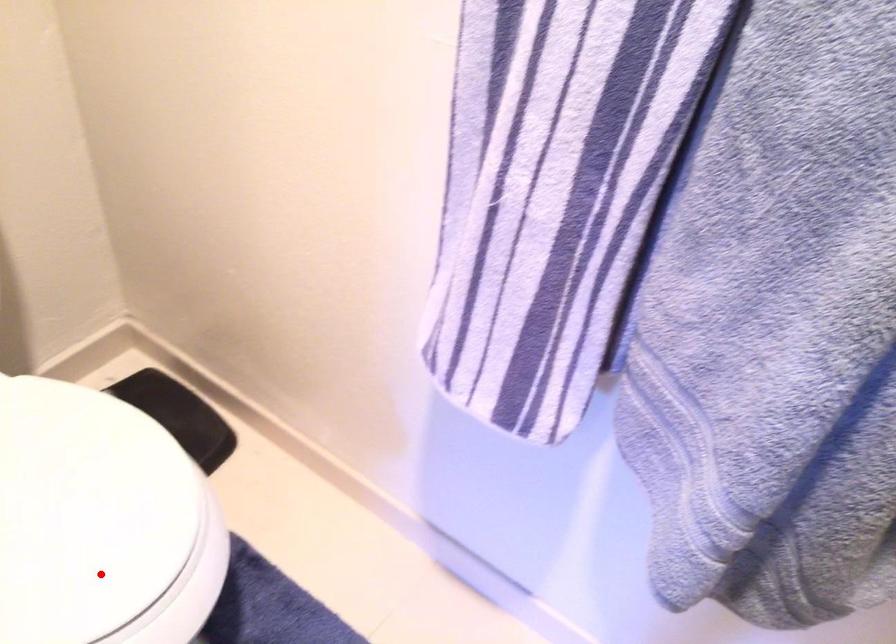
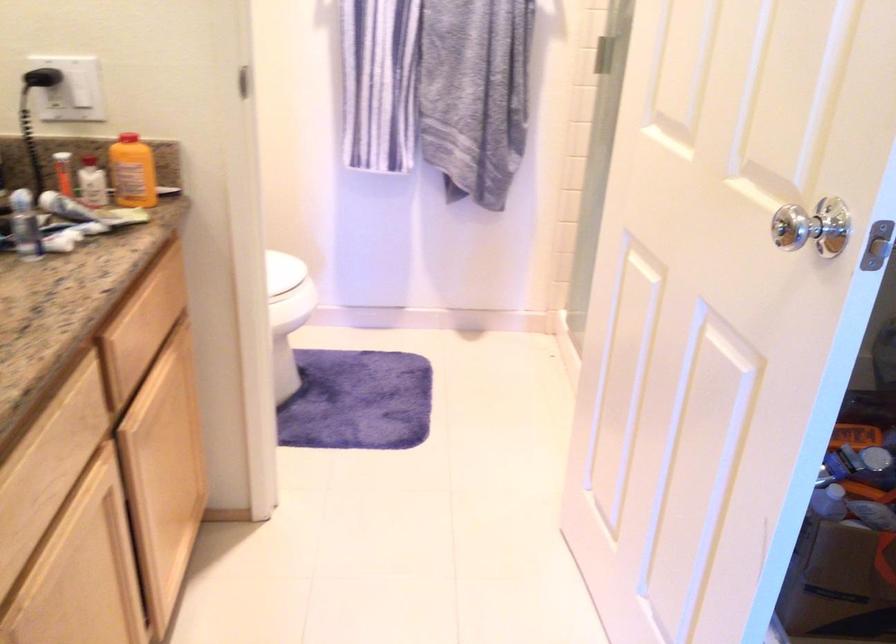
Question: I am providing you with two images of the same scene from different viewpoints. A red point is marked on the first image. Is the red point's position out of view in image 2?

Choices:
 (A) Yes
 (B) No

Answer: (B)